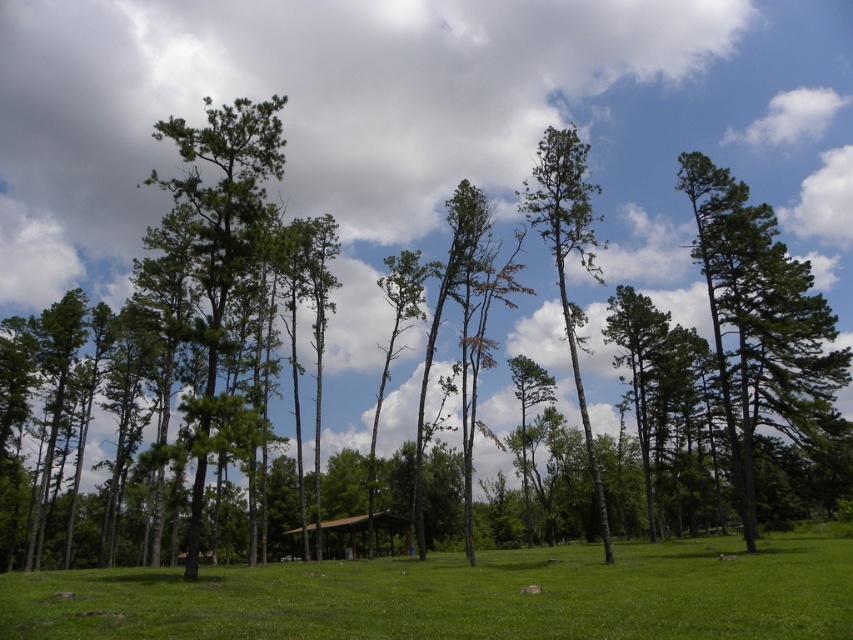
You are standing at the center of the field and see the green matte tree at right and the green bark tree at center. Which tree is positioned more to the east?

The green matte tree at right is positioned to the right of the green bark tree at center, so if you are facing north, the green matte tree at right would be more to the east.

You are planning to set up a tent in this outdoor area. Considering the green matte tree at right and the brown wooden hut at center, which one is taller and would provide better shade?

The green matte tree at right is taller than the brown wooden hut at center, so it would provide better shade.

You are standing in the middle of the field and want to walk towards the pavilion in the background. Which direction should you go relative to the green grass at center and the green bark tree at center?

The pavilion is located in the background amidst the trees. Since the green grass at center might be wider than the green bark tree at center, you should head towards the direction opposite of the green bark tree at center to reach the pavilion.